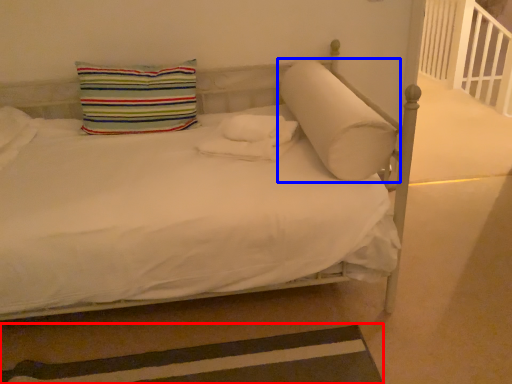
Question: Which of the following is the farthest to the observer, strip (highlighted by a red box) or pillow (highlighted by a blue box)?

Choices:
 (A) strip
 (B) pillow

Answer: (B)